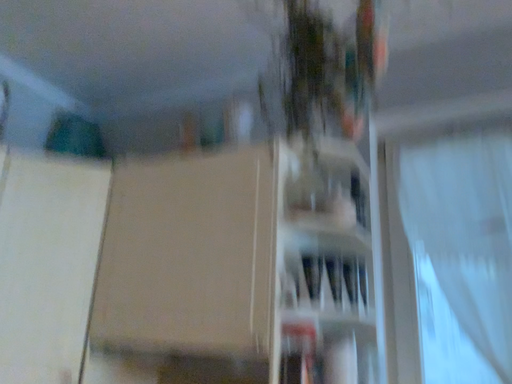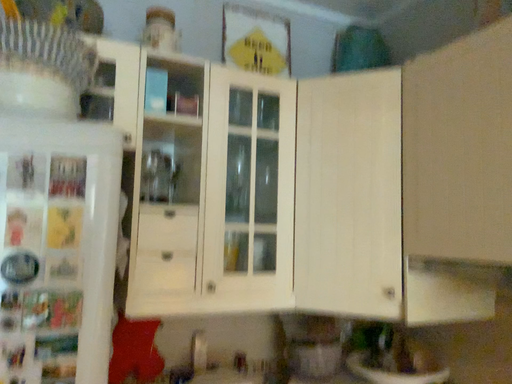
Question: Which way did the camera rotate in the video?

Choices:
 (A) rotated right
 (B) rotated left

Answer: (B)